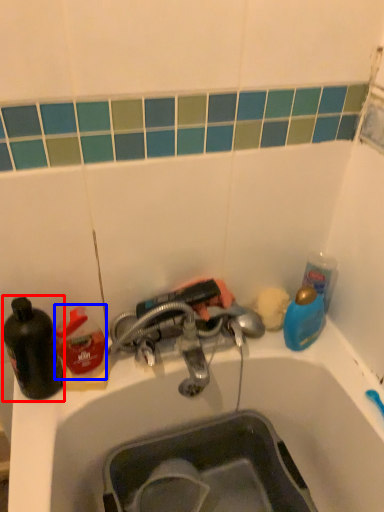
Question: Which object is further to the camera taking this photo, bottle (highlighted by a red box) or cleaning product (highlighted by a blue box)?

Choices:
 (A) bottle
 (B) cleaning product

Answer: (B)